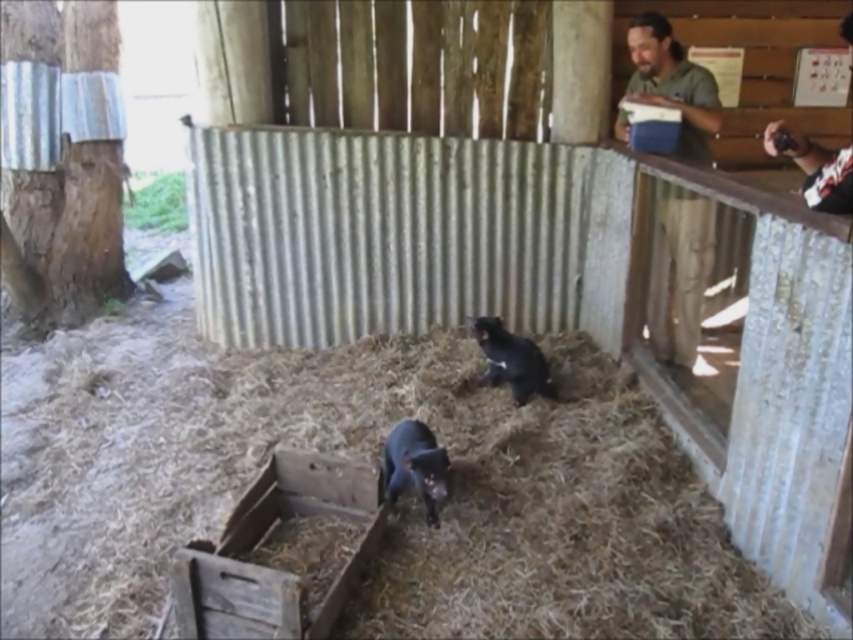
Question: Can you confirm if rusty wooden crate at lower left is positioned to the left of black matte animal at center?

Choices:
 (A) no
 (B) yes

Answer: (B)

Question: From the image, what is the correct spatial relationship of green matte shirt at upper right in relation to black matte animal at center?

Choices:
 (A) above
 (B) below

Answer: (A)

Question: Is green matte shirt at upper right above black matte animal at center?

Choices:
 (A) yes
 (B) no

Answer: (A)

Question: Estimate the real-world distances between objects in this image. Which object is farther from the white shirt at upper right?

Choices:
 (A) shiny black cat at center
 (B) rusty wooden crate at lower left
 (C) green matte shirt at upper right
 (D) black matte animal at center

Answer: (B)

Question: Which of the following is the farthest from the observer?

Choices:
 (A) black matte animal at center
 (B) shiny black cat at center

Answer: (A)

Question: Considering the real-world distances, which object is farthest from the rusty wooden crate at lower left?

Choices:
 (A) white shirt at upper right
 (B) black matte animal at center
 (C) green matte shirt at upper right
 (D) shiny black cat at center

Answer: (C)